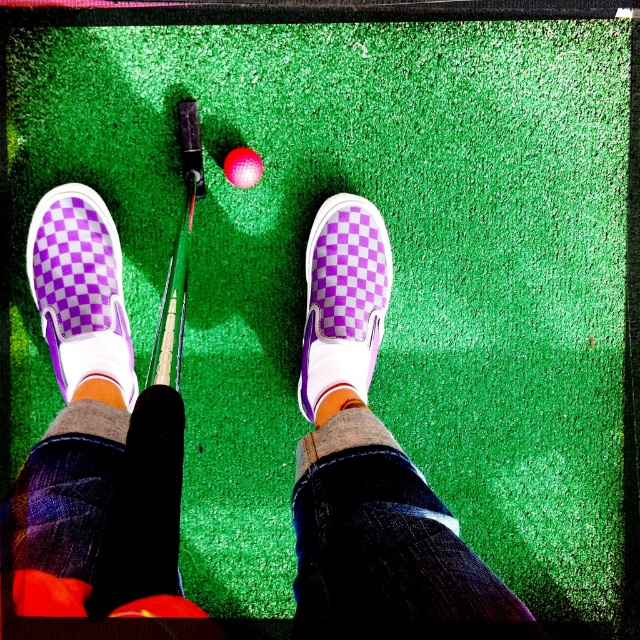
You are a golfer standing behind the metallic silver golf club at center and the matte pink golf ball at center on a mini golf course. Which object is closer to you?

The metallic silver golf club at center is closer to you because it is in front of the matte pink golf ball at center.

You are a miniature golfer standing at the edge of the green. You notice the purple checkered shoes at center and the orange fabric sock at center. How far apart are these two items in inches?

The purple checkered shoes at center is 12.56 inches from orange fabric sock at center.